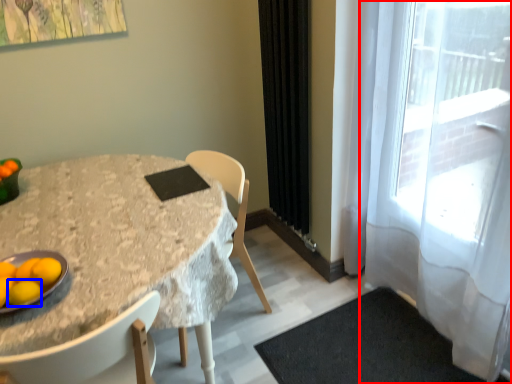
Question: Among these objects, which one is nearest to the camera, curtain (highlighted by a red box) or lemon (highlighted by a blue box)?

Choices:
 (A) curtain
 (B) lemon

Answer: (A)